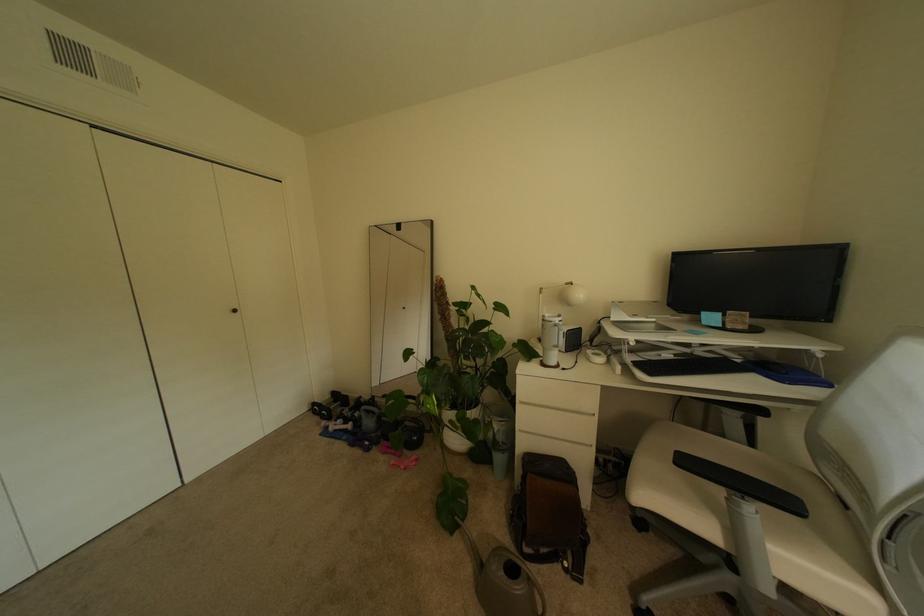
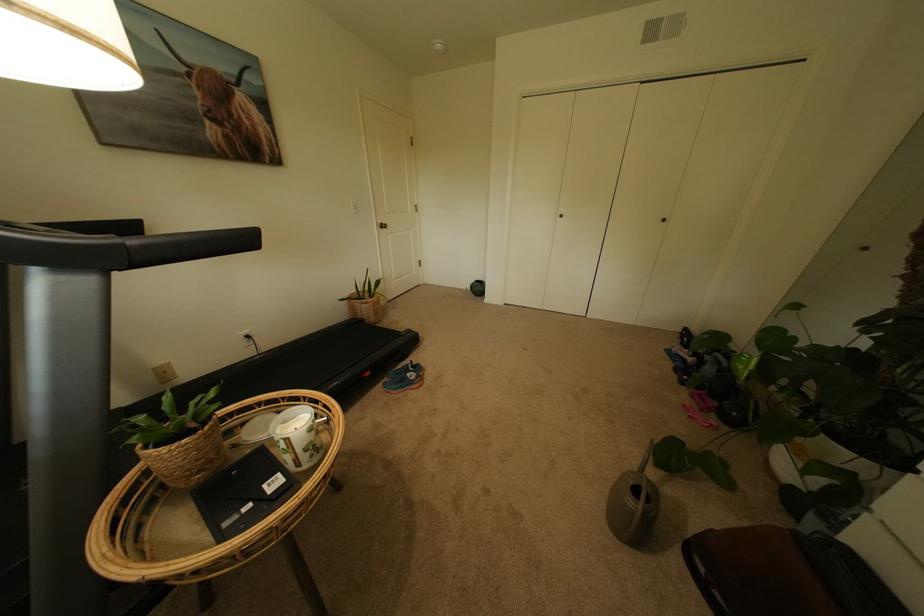
Where in the second image is the point corresponding to point 512,575 from the first image?

(639, 484)